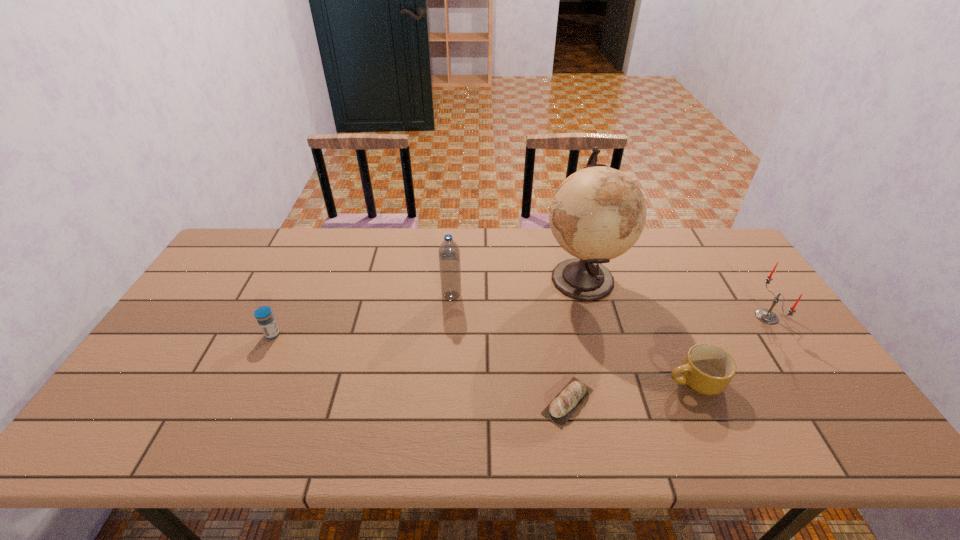
The height and width of the screenshot is (540, 960). Find the location of `globe`. globe is located at coordinates (598, 213).

The height and width of the screenshot is (540, 960). In order to click on the fifth shortest object in this screenshot , I will do click(x=449, y=254).

The width and height of the screenshot is (960, 540). I want to click on the second object from left to right, so click(449, 254).

The image size is (960, 540). In order to click on the rightmost object in this screenshot , I will do `click(767, 316)`.

At what (x,y) coordinates should I click in order to perform the action: click on the fourth shortest object. Please return your answer as a coordinate pair (x, y). Looking at the image, I should click on (767, 316).

At what (x,y) coordinates should I click in order to perform the action: click on the leftmost object. Please return your answer as a coordinate pair (x, y). The width and height of the screenshot is (960, 540). Looking at the image, I should click on pyautogui.click(x=264, y=316).

I want to click on the second object from right to left, so click(707, 369).

Find the location of a particular element. the shortest object is located at coordinates (564, 405).

You are a GUI agent. You are given a task and a screenshot of the screen. Output one action in this format:
    pyautogui.click(x=<x>, y=<y>)
    Task: Click on the vacant space situated on the front-facing side of the tallest object
    The height and width of the screenshot is (540, 960).
    Given the screenshot: What is the action you would take?
    435,278

What are the coordinates of `vacant space located 0.070m on the front-facing side of the tallest object` in the screenshot? It's located at (519, 278).